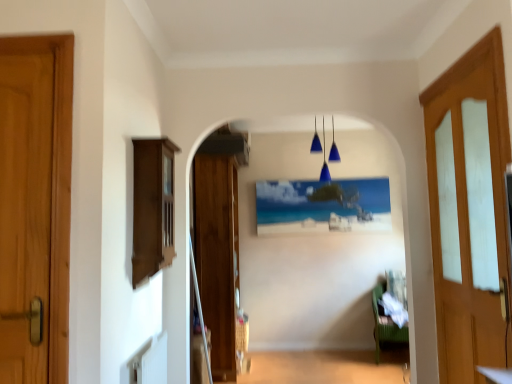
Find the location of a particular element. free point to the left of green fabric couch at lower right is located at coordinates (356, 357).